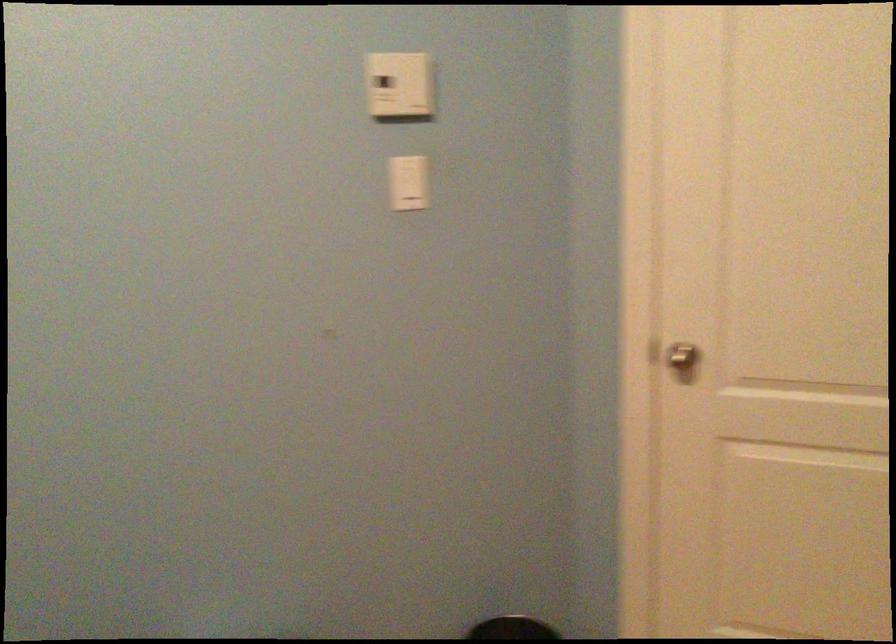
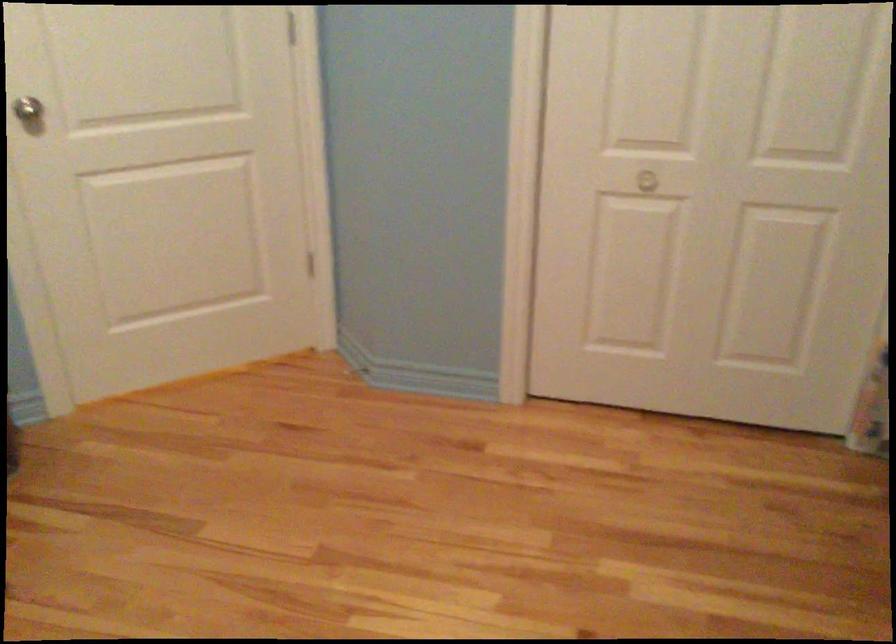
The point at (684, 354) is marked in the first image. Where is the corresponding point in the second image?

(29, 111)